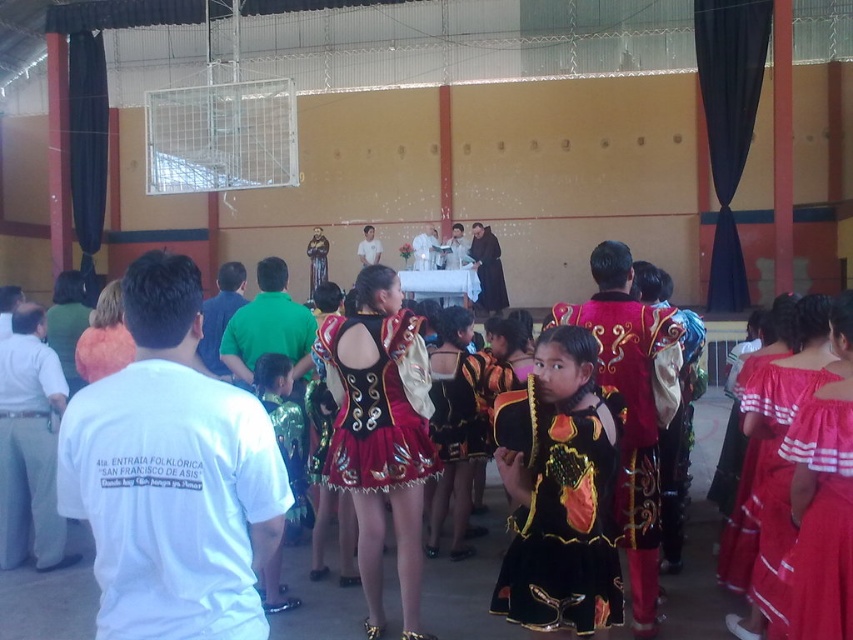
Does shiny gold fabric dress at center appear under red cotton dress at right?

Actually, shiny gold fabric dress at center is above red cotton dress at right.

Does shiny gold fabric dress at center have a lesser height compared to red cotton dress at right?

Correct, shiny gold fabric dress at center is not as tall as red cotton dress at right.

Does point (357, 477) come farther from viewer compared to point (727, 534)?

No, (357, 477) is closer to viewer.

Locate an element on the screen. This screenshot has width=853, height=640. shiny gold fabric dress at center is located at coordinates (376, 410).

Can you confirm if black velvet dress at center is bigger than red cotton dress at right?

No, black velvet dress at center is not bigger than red cotton dress at right.

Which is more to the left, black velvet dress at center or red cotton dress at right?

black velvet dress at center is more to the left.

Between point (576, 538) and point (755, 547), which one is positioned behind?

Point (755, 547)

Image resolution: width=853 pixels, height=640 pixels. Find the location of `black velvet dress at center`. black velvet dress at center is located at coordinates (560, 515).

Can you confirm if black velvet dress at center is taller than shiny metallic skirt at center?

No.

Based on the photo, between black velvet dress at center and shiny metallic skirt at center, which one has more height?

With more height is shiny metallic skirt at center.

The image size is (853, 640). What do you see at coordinates (560, 515) in the screenshot? I see `black velvet dress at center` at bounding box center [560, 515].

This screenshot has height=640, width=853. Identify the location of black velvet dress at center. coord(560,515).